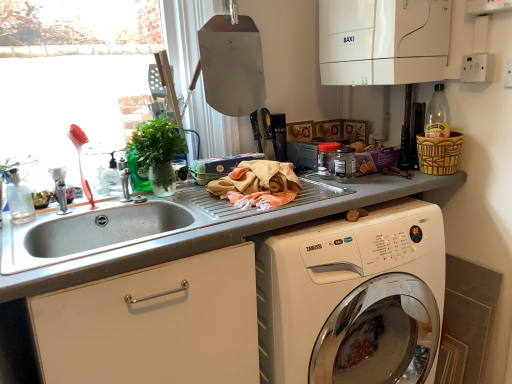
Question: Considering the relative sizes of pink plastic brush at left and green leafy plant at upper left in the image provided, is pink plastic brush at left shorter than green leafy plant at upper left?

Choices:
 (A) yes
 (B) no

Answer: (B)

Question: Is pink plastic brush at left positioned beyond the bounds of green leafy plant at upper left?

Choices:
 (A) no
 (B) yes

Answer: (B)

Question: Is green leafy plant at upper left surrounded by pink plastic brush at left?

Choices:
 (A) no
 (B) yes

Answer: (A)

Question: Is pink plastic brush at left oriented away from green leafy plant at upper left?

Choices:
 (A) no
 (B) yes

Answer: (A)

Question: Could you tell me if pink plastic brush at left is turned towards green leafy plant at upper left?

Choices:
 (A) no
 (B) yes

Answer: (A)

Question: In the image, is white glossy boiler at upper right, marked as the third appliance in a bottom-to-top arrangement, positioned in front of or behind white glossy washing machine at lower right?

Choices:
 (A) behind
 (B) front

Answer: (A)

Question: Considering the positions of white glossy boiler at upper right, the first appliance from the top, and white glossy washing machine at lower right in the image, is white glossy boiler at upper right, the first appliance from the top, taller or shorter than white glossy washing machine at lower right?

Choices:
 (A) short
 (B) tall

Answer: (A)

Question: In terms of width, does white glossy boiler at upper right, marked as the third appliance in a bottom-to-top arrangement, look wider or thinner when compared to white glossy washing machine at lower right?

Choices:
 (A) wide
 (B) thin

Answer: (B)

Question: Is white glossy boiler at upper right, the first appliance from the top, situated inside white glossy washing machine at lower right or outside?

Choices:
 (A) inside
 (B) outside

Answer: (B)

Question: Considering the positions of transparent glass window screen at upper left and transparent glass jar at center, which is the third appliance in top-to-bottom order, in the image, is transparent glass window screen at upper left wider or thinner than transparent glass jar at center, which is the third appliance in top-to-bottom order,?

Choices:
 (A) wide
 (B) thin

Answer: (A)

Question: From a real-world perspective, is transparent glass window screen at upper left physically located above or below transparent glass jar at center, acting as the first appliance starting from the bottom?

Choices:
 (A) above
 (B) below

Answer: (A)

Question: Visually, is transparent glass window screen at upper left positioned to the left or to the right of transparent glass jar at center, which is the third appliance in top-to-bottom order?

Choices:
 (A) left
 (B) right

Answer: (A)

Question: Does point (131, 66) appear closer or farther from the camera than point (337, 157)?

Choices:
 (A) closer
 (B) farther

Answer: (B)

Question: Relative to green leafy plant at upper left, is white glossy boiler at upper right, marked as the third appliance in a bottom-to-top arrangement, in front or behind?

Choices:
 (A) behind
 (B) front

Answer: (A)

Question: Considering the positions of point (420, 51) and point (173, 135), is point (420, 51) closer or farther from the camera than point (173, 135)?

Choices:
 (A) closer
 (B) farther

Answer: (B)